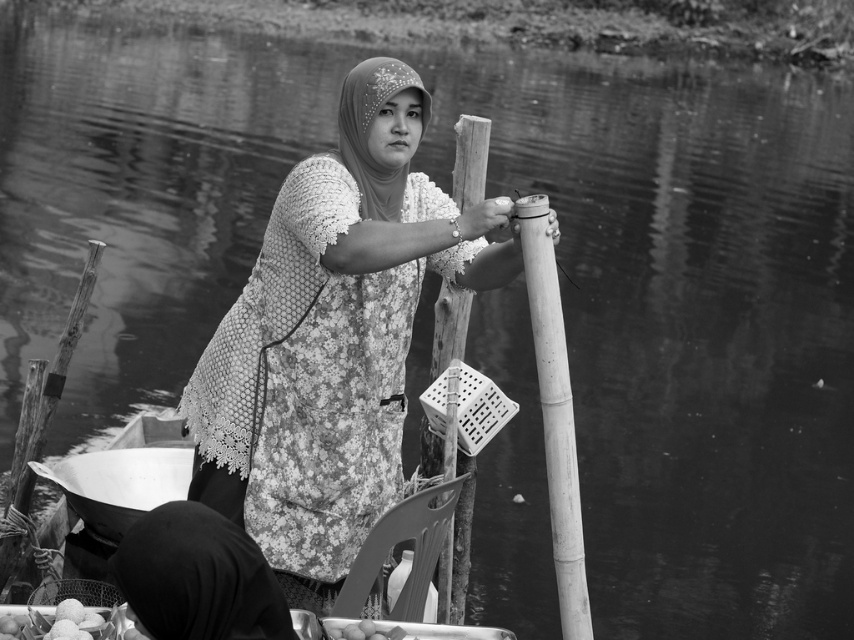
Question: Considering the real-world distances, which object is farthest from the smooth white eggs at lower center?

Choices:
 (A) lace fabric dress at center
 (B) bamboo pole at center
 (C) smooth bamboo pole at center
 (D) black lace dress at lower center

Answer: (C)

Question: Does black lace dress at lower center appear over smooth white eggs at lower center?

Choices:
 (A) no
 (B) yes

Answer: (B)

Question: Which point is closer to the camera?

Choices:
 (A) (357, 212)
 (B) (390, 636)
 (C) (566, 496)
 (D) (439, 445)

Answer: (B)

Question: Is bamboo pole at center further to the viewer compared to smooth bamboo pole at center?

Choices:
 (A) no
 (B) yes

Answer: (A)

Question: Is lace fabric dress at center to the left of bamboo pole at center from the viewer's perspective?

Choices:
 (A) yes
 (B) no

Answer: (A)

Question: Which of the following is the closest to the observer?

Choices:
 (A) black lace dress at lower center
 (B) smooth white eggs at lower center
 (C) bamboo pole at center
 (D) lace fabric dress at center

Answer: (A)